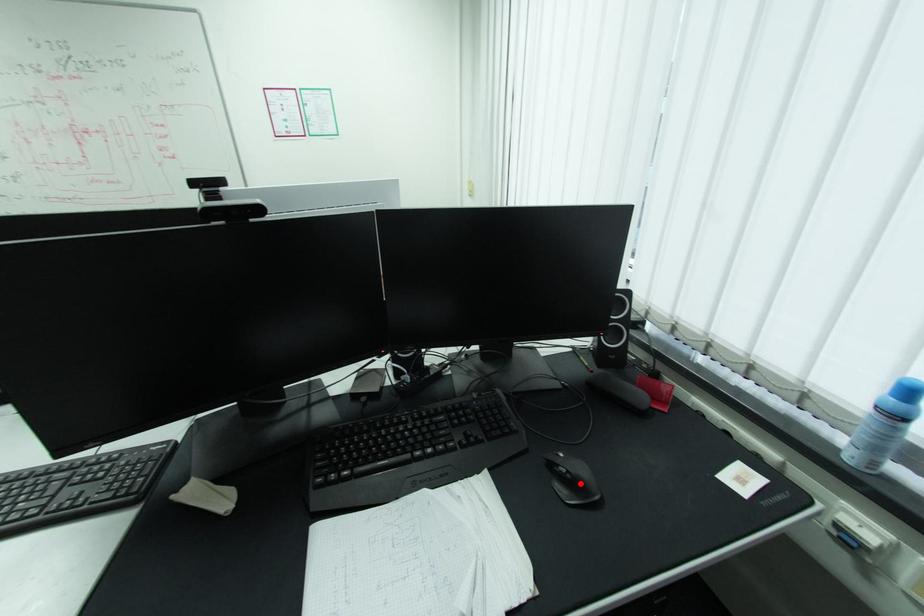
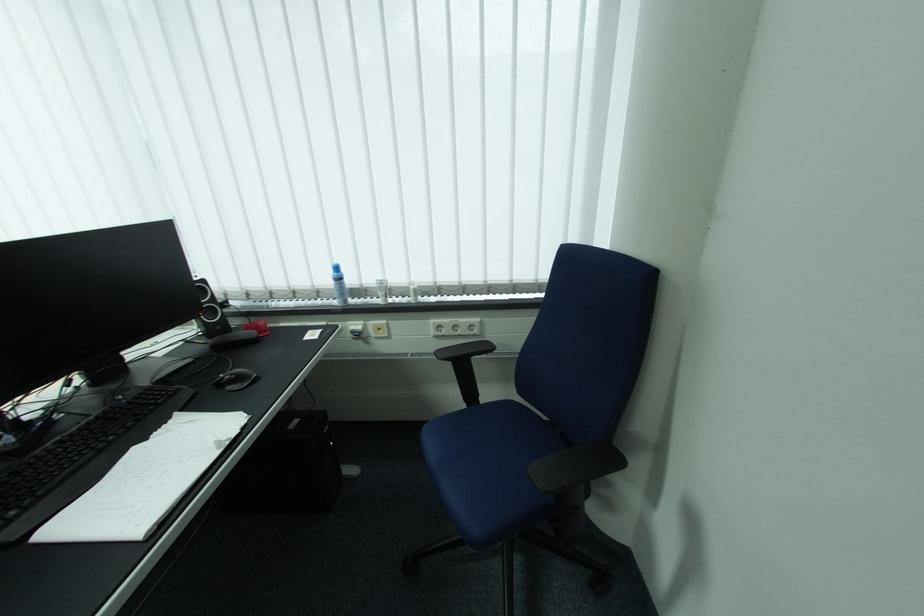
Where in the second image is the point corresponding to the highlighted location from the first image?

(245, 379)